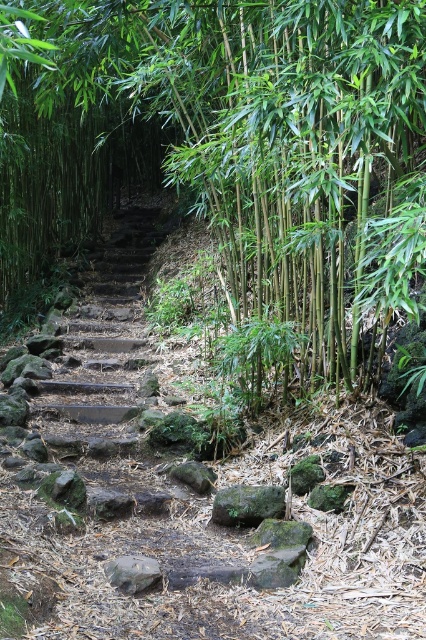
From the picture: You are a hiker trying to step on both the green mossy rock at center and the gray rough stone at center. Which rock should you step on first if you are approaching from the left side of the path?

You should step on the gray rough stone at center first because the green mossy rock at center is positioned to its right side, so the gray rough stone at center is closer to your starting position on the left.

You are standing at the starting point of the pathway in the bamboo grove. You see two points marked on the path ahead of you. The first point is at coordinates point (158, 572), and the second is at point (215, 490). Which point is closer to you as you begin walking along the path?

Point (158, 572) is in front of point (215, 490), so the first point is closer to you as you walk along the path.